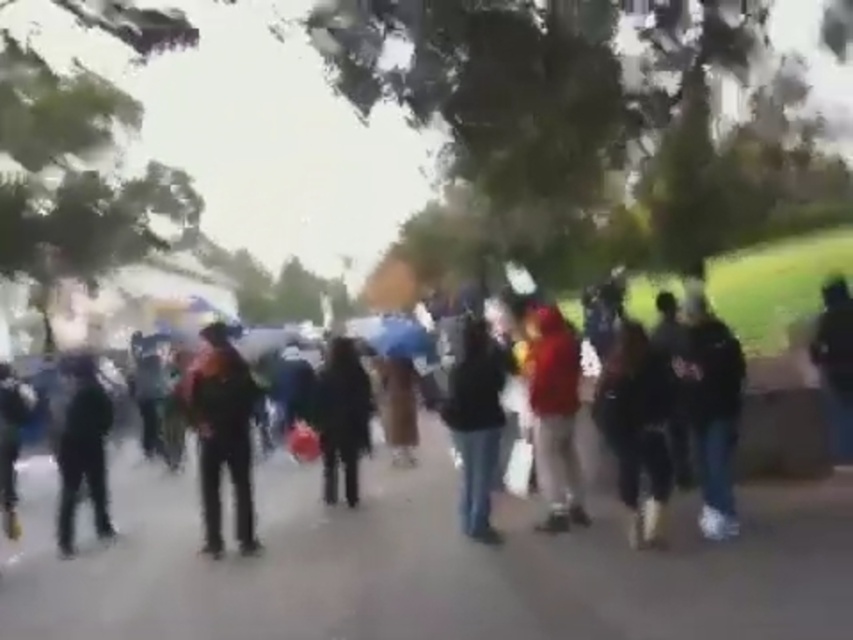
You are a photographer trying to capture a clear shot of the dark blue jeans at center and the black matte jacket at left. Since the scene is blurry, you decide to zoom in. Which object should you zoom in on first to ensure it remains in focus, considering their sizes?

The dark blue jeans at center occupies less space than the black matte jacket at left, so you should zoom in on the dark blue jeans at center first because it is smaller and might become too small to focus on if zoomed too much.

You are a photographer trying to capture a clear shot of the dark clothing crowd at center. Given the scene described, what potential challenge might you face?

The scene is somewhat blurry, suggesting motion or a low resolution capture, which could make it difficult to get a clear shot of the dark clothing crowd at center.

You are a photographer trying to capture a clear shot of the dark blue jeans at center and the black matte jacket at left. Since the scene is blurry, you decide to adjust your camera focus. Which object should you focus on first if you want to ensure the taller one is in focus?

The dark blue jeans at center is taller than the black matte jacket at left, so you should focus on the dark blue jeans at center first to ensure it is in focus.